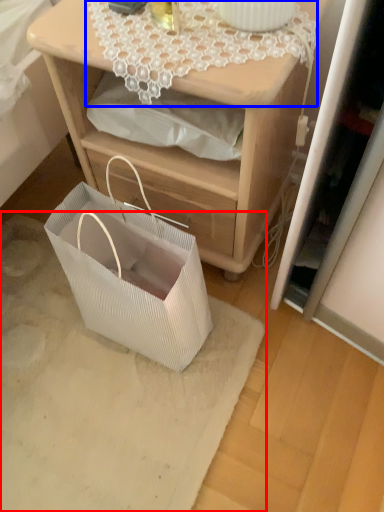
Question: Which of the following is the closest to the observer, mat (highlighted by a red box) or lace (highlighted by a blue box)?

Choices:
 (A) mat
 (B) lace

Answer: (B)